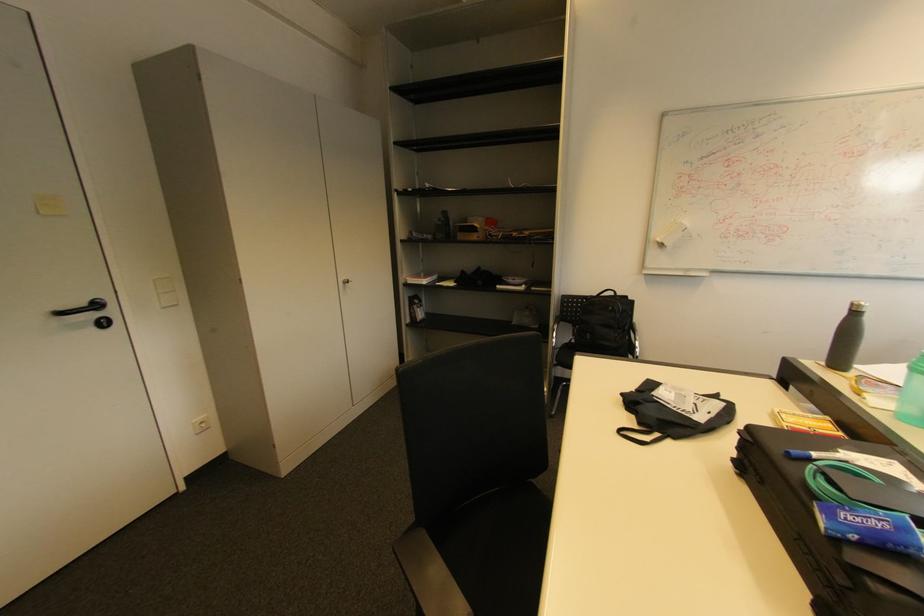
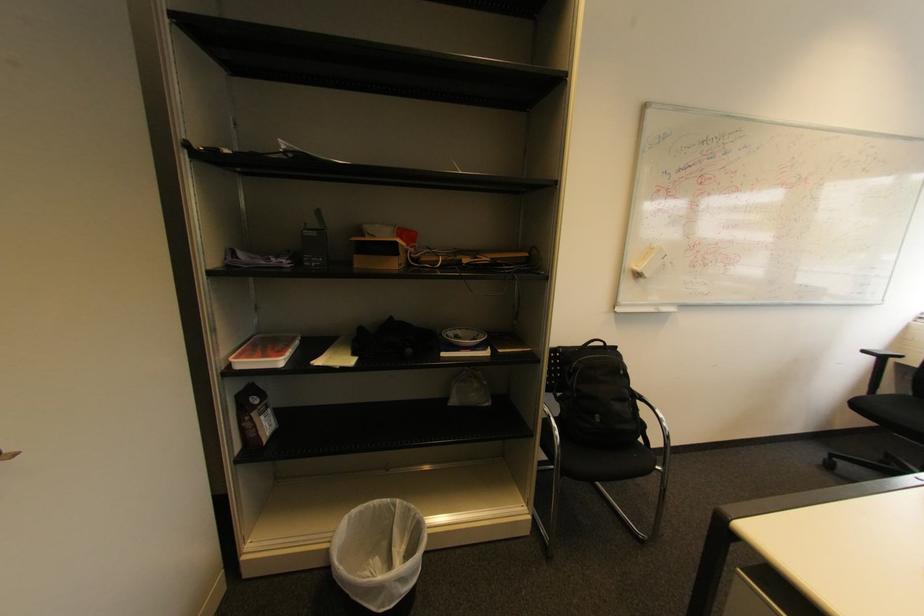
Where in the second image is the point corresponding to point 624,294 from the first image?

(613, 345)